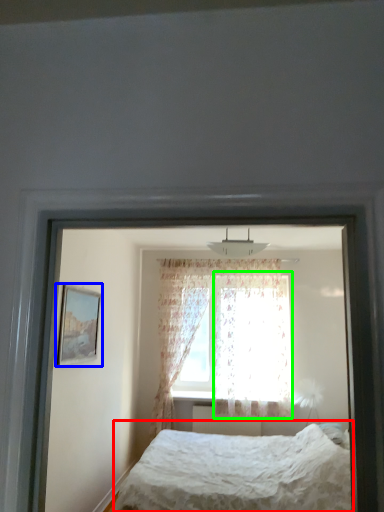
Question: Considering the real-world distances, which object is closest to bed (highlighted by a red box)? picture frame (highlighted by a blue box) or curtain (highlighted by a green box).

Choices:
 (A) picture frame
 (B) curtain

Answer: (A)